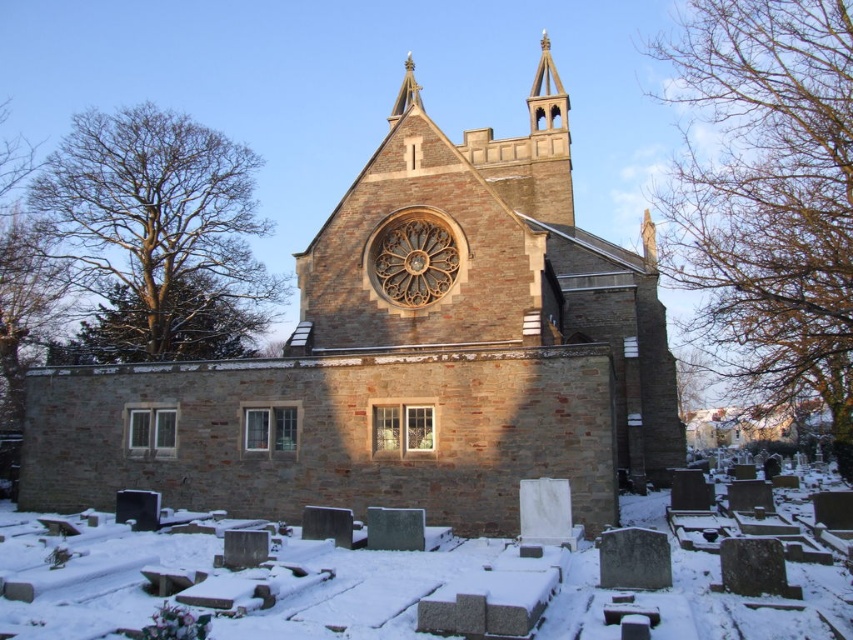
You are a photographer planning to capture the brown stone church at center and the white textured snow at center in a single shot. Considering the height difference between them, which object should you focus on to ensure both are fully visible in the frame?

The brown stone church at center is taller than the white textured snow at center, so focusing on the church will ensure both are fully visible in the frame.

You are standing at the entrance of the cemetery and want to locate the brown stone church at center. According to the coordinates provided, where should you look relative to your current position?

The brown stone church at center is located at coordinates point (402, 356), which means it is positioned slightly to the right and above your current position in the cemetery entrance.

You are a photographer standing in front of the brown stone church at center and the white textured snow at center. You want to capture both in a single shot. Which object should you focus on to ensure the larger one is properly framed?

The brown stone church at center is bigger than the white textured snow at center, so you should focus on the brown stone church at center to ensure the larger object is properly framed.